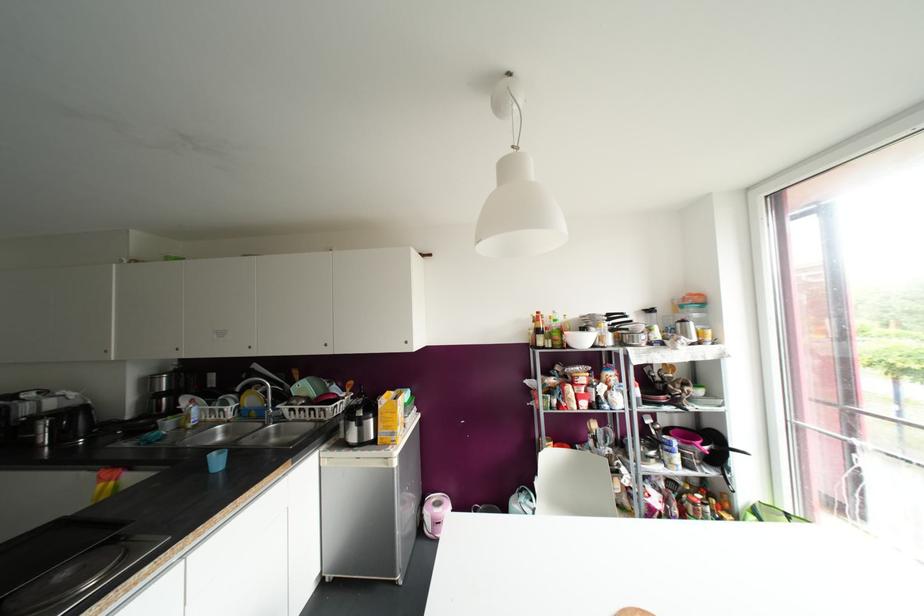
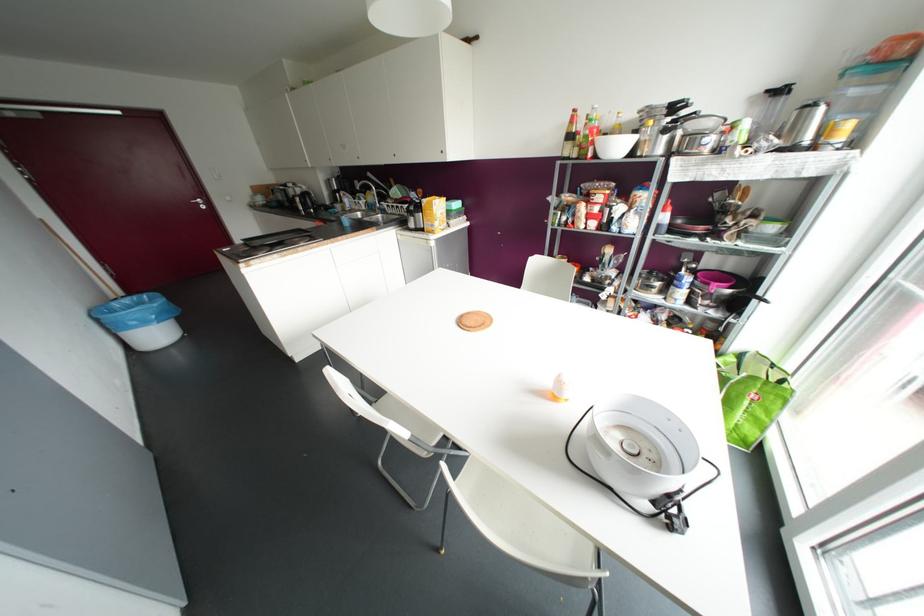
Where in the second image is the point corresponding to [568,329] from the first image?

(618, 134)